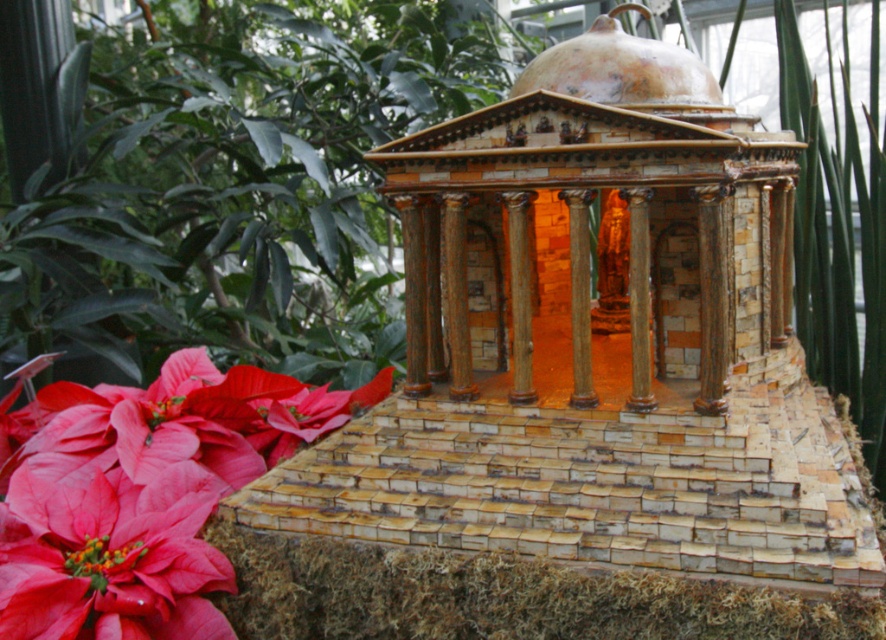
Consider the image. You are an interior designer planning a floral arrangement for a client who wants symmetry in their garden. You have two options in the scene, the matte pink petals at lower left and the matte red flower at lower left. Which one would you choose to place on the left side of the central path to maintain symmetry with the right side, assuming the right side has a flower of the same size as the larger of the two?

→ The matte pink petals at lower left is larger in size than the matte red flower at lower left. To maintain symmetry with the right side, which has a flower the same size as the larger one, you should choose the matte pink petals at lower left for the left side.